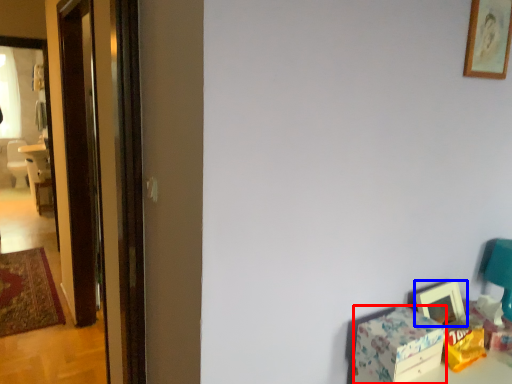
Question: Among these objects, which one is nearest to the camera, box (highlighted by a red box) or picture frame (highlighted by a blue box)?

Choices:
 (A) box
 (B) picture frame

Answer: (A)